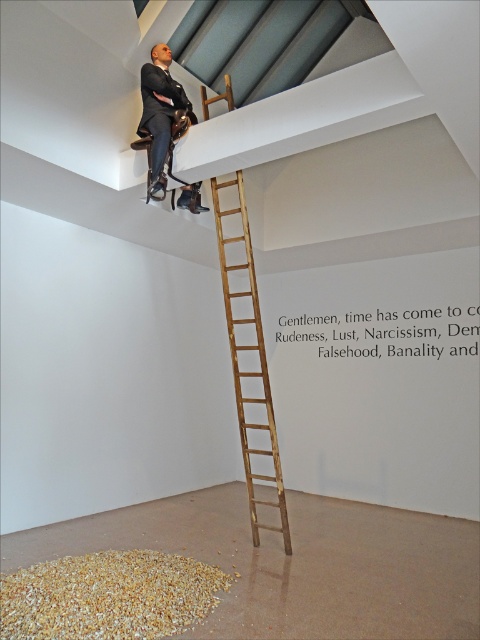
Does brown rough grain at lower left have a smaller size compared to wooden ladder at upper center?

Correct, brown rough grain at lower left occupies less space than wooden ladder at upper center.

Between point (124, 557) and point (272, 438), which one is positioned behind?

The point (272, 438) is behind.

Which is in front, point (147, 560) or point (241, 237)?

Point (147, 560) is more forward.

Locate an element on the screen. brown rough grain at lower left is located at coordinates (108, 596).

Is brown rough grain at lower left smaller than matte black suit at upper center?

Yes, brown rough grain at lower left is smaller than matte black suit at upper center.

Image resolution: width=480 pixels, height=640 pixels. What do you see at coordinates (108, 596) in the screenshot? I see `brown rough grain at lower left` at bounding box center [108, 596].

Is point (98, 579) positioned after point (144, 112)?

That is False.

Locate an element on the screen. brown rough grain at lower left is located at coordinates (108, 596).

Between point (244, 465) and point (149, 129), which one is positioned behind?

The point (244, 465) is more distant.

Which is in front, point (288, 541) or point (166, 83)?

Positioned in front is point (288, 541).

Who is more forward, (255, 307) or (163, 90)?

Point (255, 307)

This screenshot has width=480, height=640. Find the location of `wooden ladder at upper center`. wooden ladder at upper center is located at coordinates (251, 371).